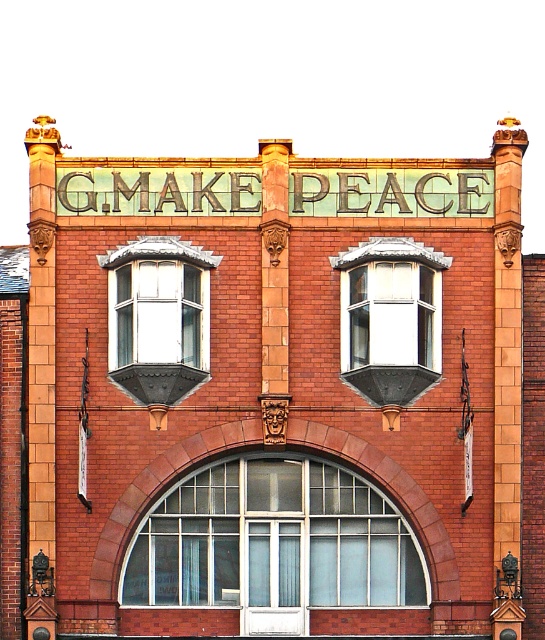
Question: Considering the real-world distances, which object is farthest from the matte glass bay window at center?

Choices:
 (A) clear glass window at center
 (B) clear glass bay window at center

Answer: (A)

Question: Which of the following is the farthest from the observer?

Choices:
 (A) clear glass bay window at center
 (B) matte glass bay window at center

Answer: (B)

Question: Which point is farther from the camera taking this photo?

Choices:
 (A) (271, 552)
 (B) (342, 259)

Answer: (B)

Question: Is the position of clear glass window at center more distant than that of matte glass bay window at center?

Choices:
 (A) yes
 (B) no

Answer: (B)

Question: Does matte glass bay window at center appear on the left side of clear glass bay window at center?

Choices:
 (A) yes
 (B) no

Answer: (A)

Question: From the image, what is the correct spatial relationship of clear glass window at center in relation to matte glass bay window at center?

Choices:
 (A) left
 (B) right

Answer: (B)